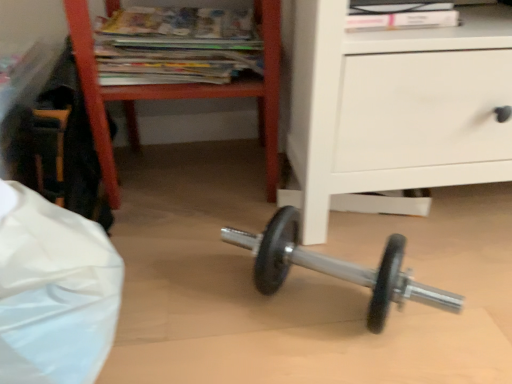
Describe the element at coordinates (176, 46) in the screenshot. I see `matte paper magazines at upper center` at that location.

Measure the distance between matte paper magazines at upper center and camera.

matte paper magazines at upper center and camera are 31.94 inches apart from each other.

Locate an element on the screen. matte paper magazines at upper center is located at coordinates (176, 46).

Locate an element on the screen. wooden magazine rack at upper left is located at coordinates (177, 92).

This screenshot has width=512, height=384. What do you see at coordinates (177, 92) in the screenshot?
I see `wooden magazine rack at upper left` at bounding box center [177, 92].

This screenshot has width=512, height=384. I want to click on matte paper magazines at upper center, so click(176, 46).

Is matte paper magazines at upper center at the left side of wooden magazine rack at upper left?

Indeed, matte paper magazines at upper center is positioned on the left side of wooden magazine rack at upper left.

Who is more distant, matte paper magazines at upper center or wooden magazine rack at upper left?

matte paper magazines at upper center is further away from the camera.

Does point (204, 22) lie in front of point (276, 12)?

No, it is behind (276, 12).

From the image's perspective, would you say matte paper magazines at upper center is positioned over wooden magazine rack at upper left?

Indeed, from the image's perspective, matte paper magazines at upper center is shown above wooden magazine rack at upper left.

From a real-world perspective, does matte paper magazines at upper center sit lower than wooden magazine rack at upper left?

Actually, matte paper magazines at upper center is physically above wooden magazine rack at upper left in the real world.

Is matte paper magazines at upper center wider than wooden magazine rack at upper left?

In fact, matte paper magazines at upper center might be narrower than wooden magazine rack at upper left.

Looking at this image, is matte paper magazines at upper center shorter than wooden magazine rack at upper left?

Indeed, matte paper magazines at upper center has a lesser height compared to wooden magazine rack at upper left.

Between matte paper magazines at upper center and wooden magazine rack at upper left, which one has smaller size?

matte paper magazines at upper center is smaller.

Is wooden magazine rack at upper left a part of matte paper magazines at upper center?

No, wooden magazine rack at upper left is not a part of matte paper magazines at upper center.

Is matte paper magazines at upper center positioned far away from wooden magazine rack at upper left?

Actually, matte paper magazines at upper center and wooden magazine rack at upper left are a little close together.

Is matte paper magazines at upper center aimed at wooden magazine rack at upper left?

Yes, matte paper magazines at upper center is oriented towards wooden magazine rack at upper left.

How many degrees apart are the facing directions of matte paper magazines at upper center and wooden magazine rack at upper left?

They differ by 3.32 degrees in their facing directions.

Identify the location of magazine that is on the left side of wooden magazine rack at upper left. (176, 46).

Which is more to the right, wooden magazine rack at upper left or matte paper magazines at upper center?

wooden magazine rack at upper left is more to the right.

Considering the positions of objects wooden magazine rack at upper left and matte paper magazines at upper center in the image provided, who is in front, wooden magazine rack at upper left or matte paper magazines at upper center?

wooden magazine rack at upper left is more forward.

Between point (163, 90) and point (220, 12), which one is positioned in front?

The point (163, 90) is more forward.

From the image's perspective, is wooden magazine rack at upper left over matte paper magazines at upper center?

Actually, wooden magazine rack at upper left appears below matte paper magazines at upper center in the image.

From a real-world perspective, is wooden magazine rack at upper left physically below matte paper magazines at upper center?

Yes, from a real-world perspective, wooden magazine rack at upper left is below matte paper magazines at upper center.

Looking at their sizes, would you say wooden magazine rack at upper left is wider or thinner than matte paper magazines at upper center?

wooden magazine rack at upper left is wider than matte paper magazines at upper center.

In terms of height, does wooden magazine rack at upper left look taller or shorter compared to matte paper magazines at upper center?

A: Clearly, wooden magazine rack at upper left is taller compared to matte paper magazines at upper center.

Can you confirm if wooden magazine rack at upper left is bigger than matte paper magazines at upper center?

Correct, wooden magazine rack at upper left is larger in size than matte paper magazines at upper center.

Is matte paper magazines at upper center located within wooden magazine rack at upper left?

Absolutely, matte paper magazines at upper center is inside wooden magazine rack at upper left.

Is there a large distance between wooden magazine rack at upper left and matte paper magazines at upper center?

No, wooden magazine rack at upper left is not far away from matte paper magazines at upper center.

Is matte paper magazines at upper center at the back of wooden magazine rack at upper left?

That's right, wooden magazine rack at upper left is facing away from matte paper magazines at upper center.

Identify the location of magazine on the left of wooden magazine rack at upper left. (176, 46).

This screenshot has width=512, height=384. In the image, there is a matte paper magazines at upper center. Identify the location of furniture below it (from the image's perspective). (177, 92).

The width and height of the screenshot is (512, 384). I want to click on magazine above the wooden magazine rack at upper left (from the image's perspective), so click(x=176, y=46).